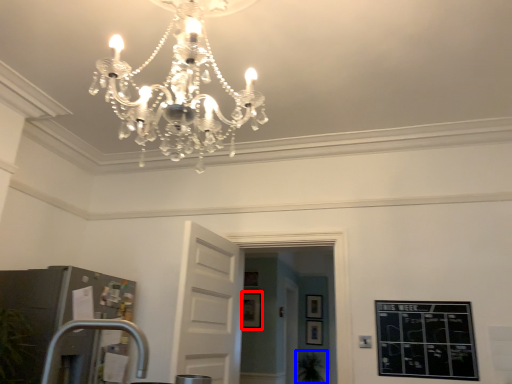
Question: Which object is further to the camera taking this photo, picture frame (highlighted by a red box) or plant (highlighted by a blue box)?

Choices:
 (A) picture frame
 (B) plant

Answer: (B)